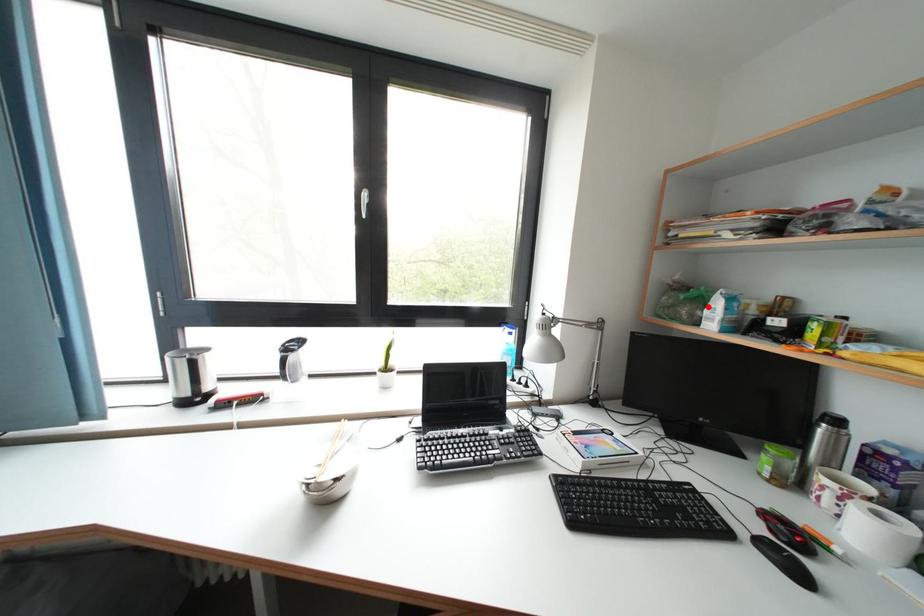
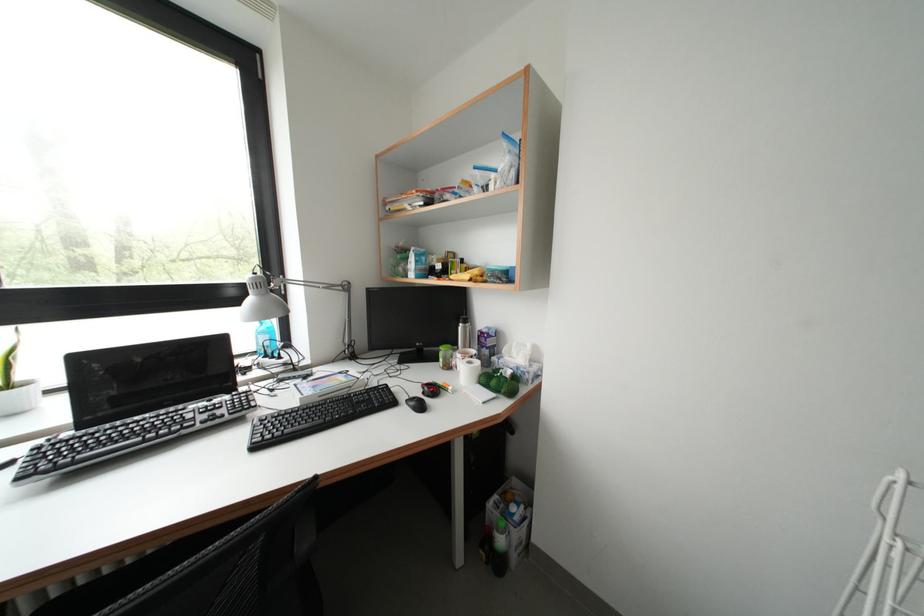
Find the pixel in the second image that matches the highlighted location in the first image.

(415, 264)